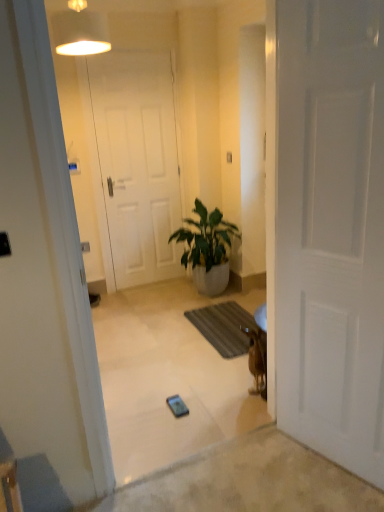
Identify the location of free space in front of white matte door at center, placed as the second door when sorted from back to front. (334, 489).